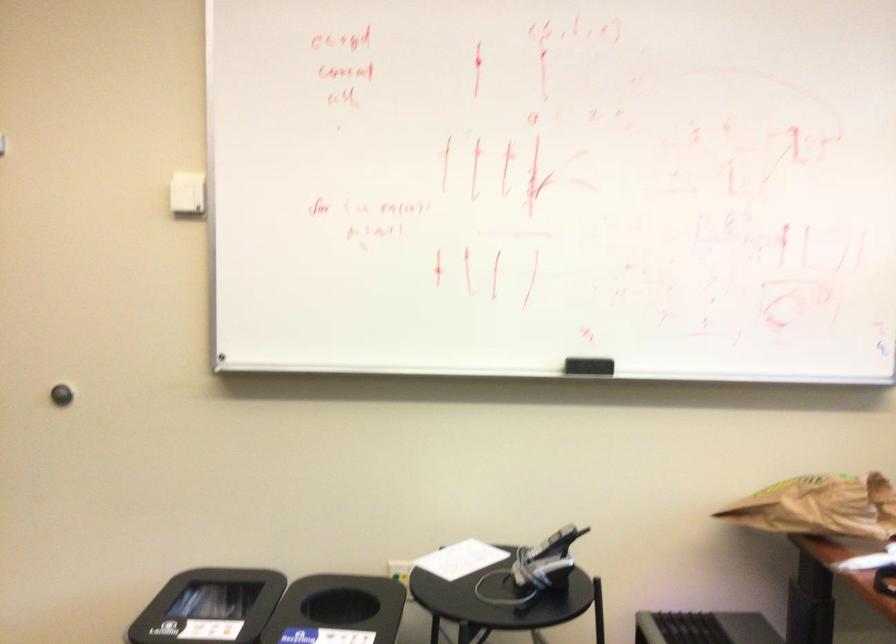
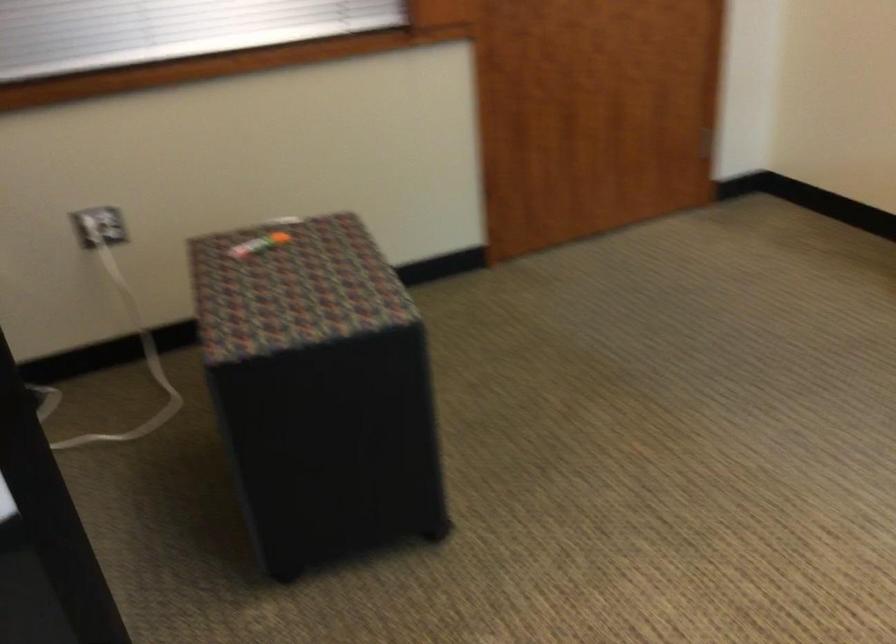
The first image is from the beginning of the video and the second image is from the end. How did the camera likely rotate when shooting the video?

The rotation direction of the camera is left-down.